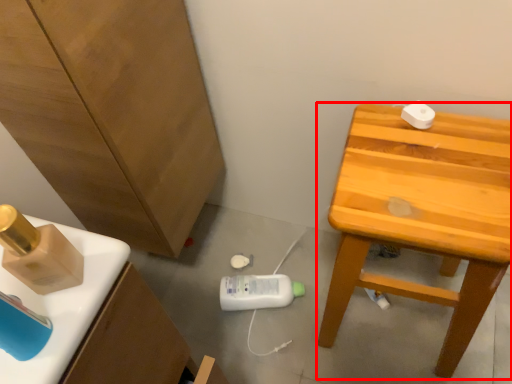
Question: From the image's perspective, where is stool (annotated by the red box) located relative to cabinetry?

Choices:
 (A) above
 (B) below

Answer: (B)